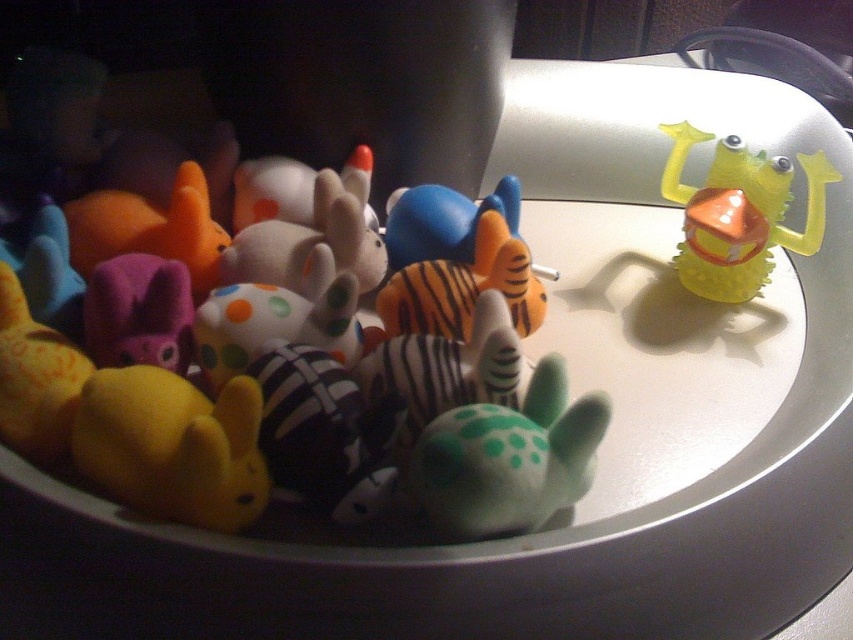
You are an interior designer arranging a display of colorful clay animal figurines in a dimly lit room. You need to place a new shiny goldfish figurine in the exact location marked by the point coordinates point (286, 419). However, there is already an object there. What is the object currently occupying that spot?

The point (286, 419) indicates the location of the matte rubber frog at upper right, so the shiny goldfish figurine cannot be placed there as it is already occupied by the matte rubber frog at upper right.

You are organizing a display of clay animal figurines. You have a green matte turtle at center and a matte purple plush at left. Which figurine is narrower in width?

The green matte turtle at center is thinner than the matte purple plush at left, so the green matte turtle at center is narrower in width.

You are holding a flashlight and want to illuminate the point at coordinates point [318,410] in the scene. The flashlight has a range of 25 inches. Can you reach the point with the flashlight?

The distance between point [318,410] and the viewer is 25.86 inches, which is slightly beyond the flashlight range of 25 inches. Therefore, the flashlight cannot reach the point.